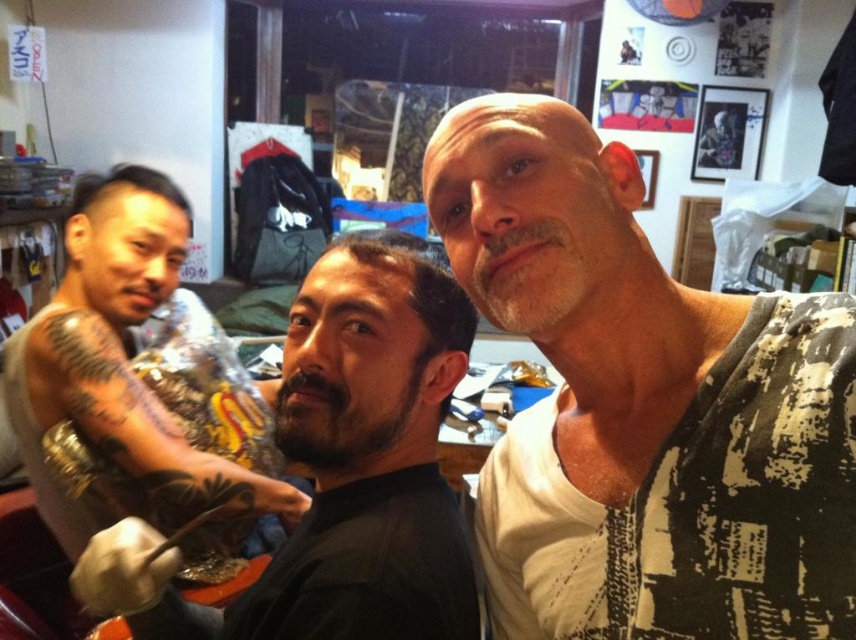
You are a customer in a tattoo parlor and want to choose between two items to place on the counter. The items are the white textured shirt at upper right and the dark brown hair at left. Based on their sizes, which item would require a taller space on the counter?

The white textured shirt at upper right requires a taller space on the counter because it has a greater height compared to the dark brown hair at left.

You are a new tattoo artist entering the room and need to reach the dark skin tattooed arm at left and the dark brown hair at left. Which object is closer to you when you first enter the room?

The dark skin tattooed arm at left is closer to you than the dark brown hair at left because they are 6.31 feet apart, so the arm is nearer.

You are a customer entering the tattoo parlor and want to approach the artist. You see the white textured shirt at upper right and the dark brown hair at left. Which one should you look towards to find the artist?

The white textured shirt at upper right is closer to the viewer than the dark brown hair at left, so the artist is likely near the white textured shirt at upper right.